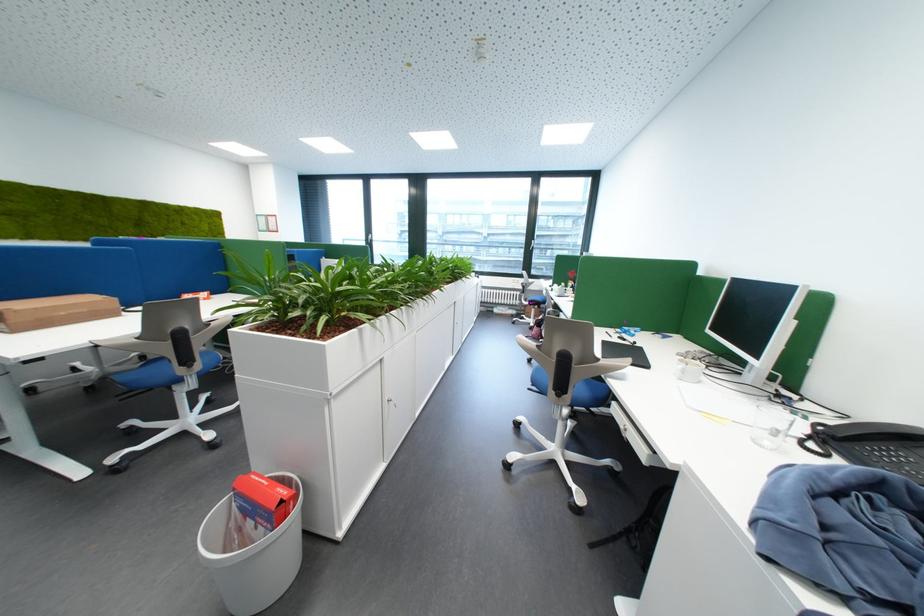
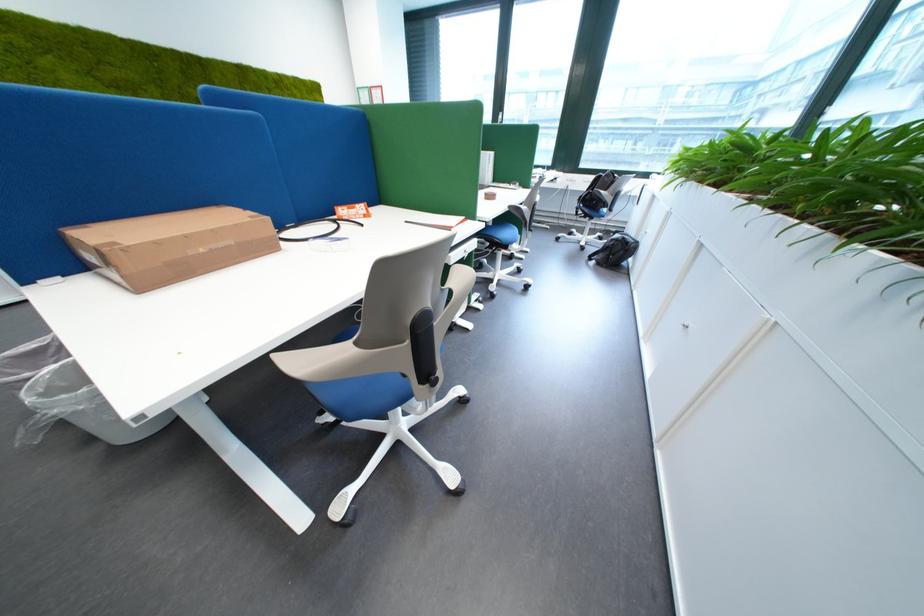
Which direction would the cameraman need to move to produce the second image?

The cameraman moved toward left, forward.